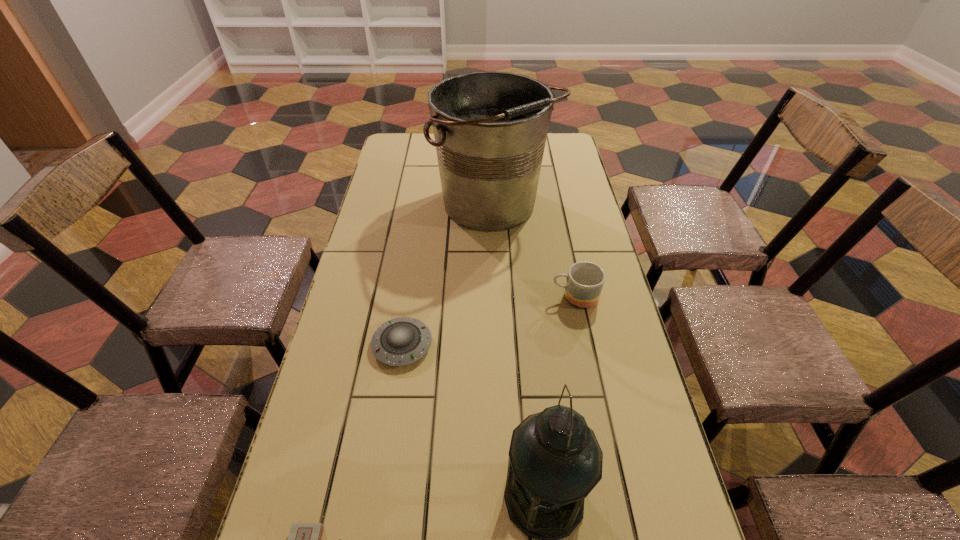
Locate an element on the screen. This screenshot has width=960, height=540. bucket is located at coordinates (490, 128).

Locate an element on the screen. the second farthest object is located at coordinates (585, 280).

The height and width of the screenshot is (540, 960). I want to click on the third shortest object, so click(585, 280).

In order to click on saucer in this screenshot , I will do `click(401, 341)`.

Find the location of `the third farthest object`. the third farthest object is located at coordinates (401, 341).

Identify the location of free region located on the back of the farthest object. (492, 150).

The width and height of the screenshot is (960, 540). Identify the location of vacant space situated 0.050m on the side with the handle of the fourth nearest object. (533, 297).

The width and height of the screenshot is (960, 540). What are the coordinates of `vacant space located 0.060m on the side with the handle of the fourth nearest object` in the screenshot? It's located at (529, 297).

You are a GUI agent. You are given a task and a screenshot of the screen. Output one action in this format:
    pyautogui.click(x=<x>, y=<y>)
    Task: Click on the free region located 0.400m on the side with the handle of the fourth nearest object
    The image size is (960, 540).
    Given the screenshot: What is the action you would take?
    pyautogui.click(x=408, y=297)

Locate an element on the screen. vacant space located 0.220m on the front of the saucer is located at coordinates (385, 461).